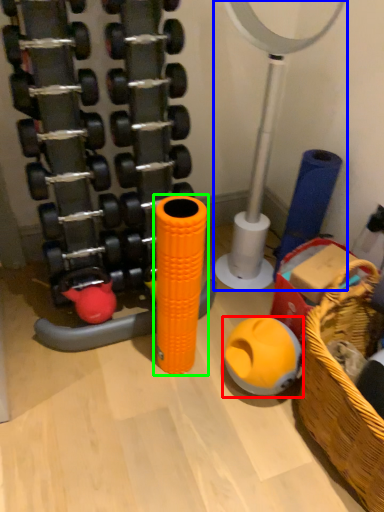
Question: Which is nearer to the toy (highlighted by a red box)? basketball hoop (highlighted by a blue box) or toy (highlighted by a green box).

Choices:
 (A) basketball hoop
 (B) toy

Answer: (B)